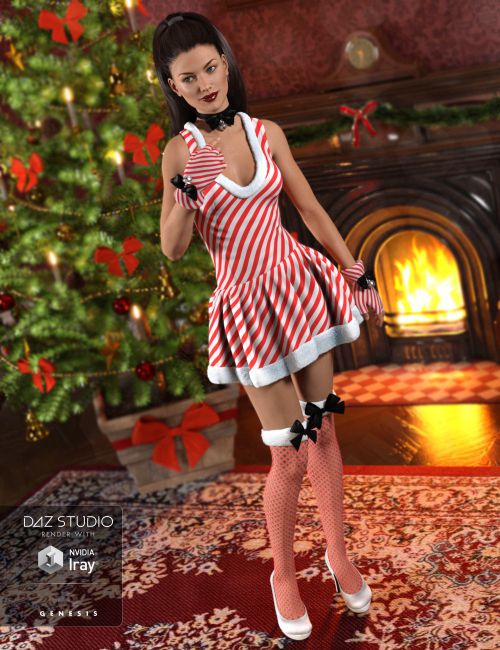
At what (x,y) coordinates should I click in order to perform the action: click on fireplace. Please return your answer as a coordinate pair (x, y). The height and width of the screenshot is (650, 500). Looking at the image, I should click on (424, 203).